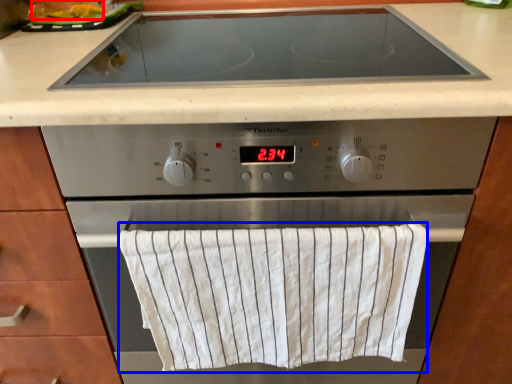
Question: Which of the following is the farthest to the observer, food (highlighted by a red box) or bath towel (highlighted by a blue box)?

Choices:
 (A) food
 (B) bath towel

Answer: (A)